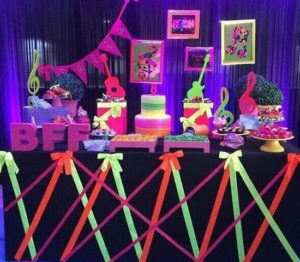
Where is `ribbon`? ribbon is located at coordinates (9, 156).